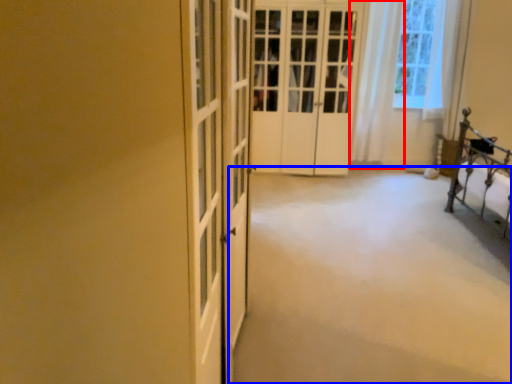
Question: Which of the following is the farthest to the observer, curtain (highlighted by a red box) or plain (highlighted by a blue box)?

Choices:
 (A) curtain
 (B) plain

Answer: (A)